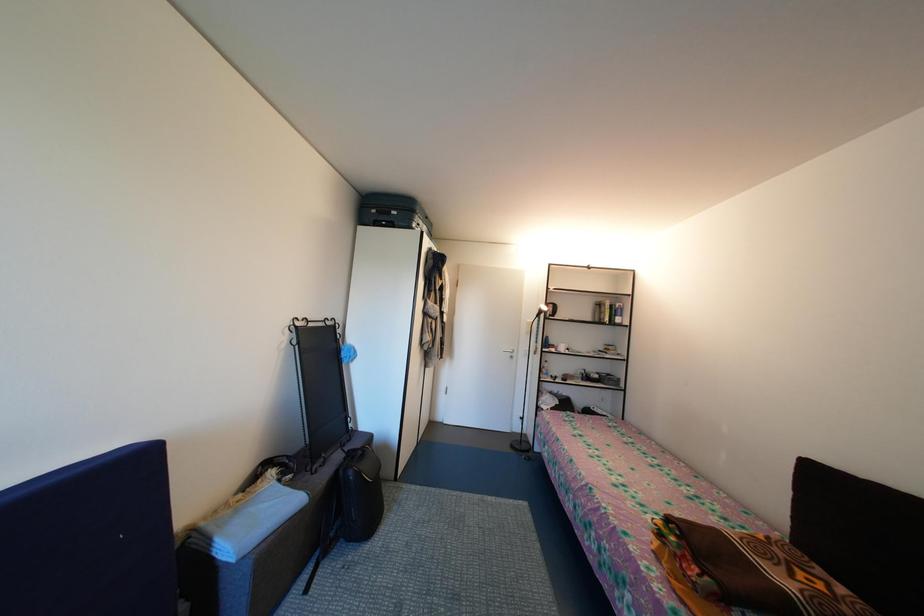
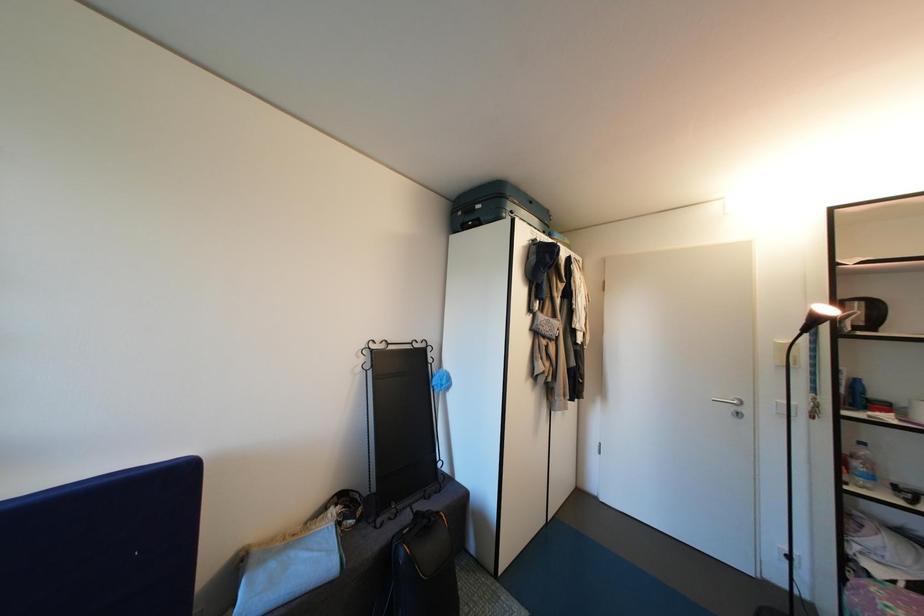
Question: The first image is from the beginning of the video and the second image is from the end. How did the camera likely rotate when shooting the video?

Choices:
 (A) Left
 (B) Right
 (C) Up
 (D) Down

Answer: (A)